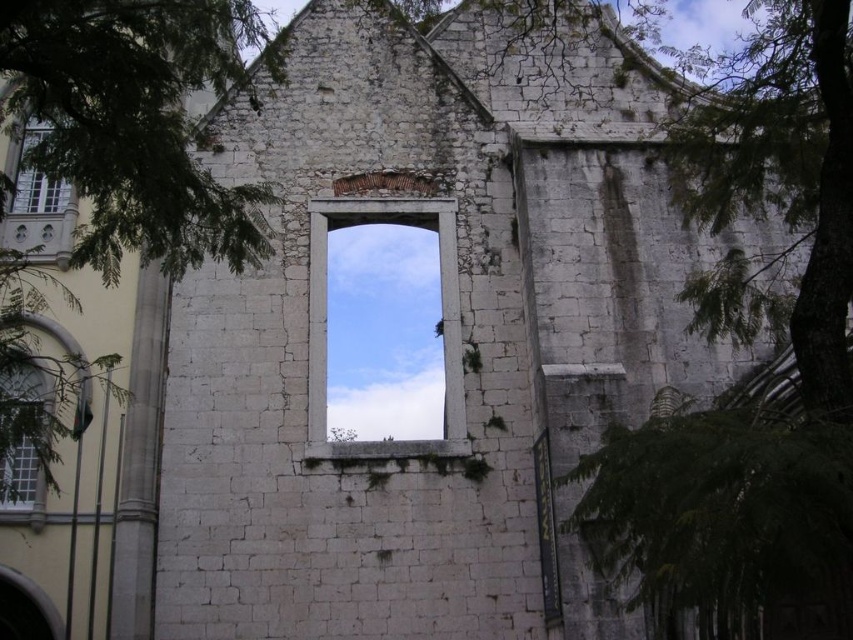
Between point (236, 220) and point (315, 248), which one is positioned in front?

Point (236, 220) is in front.

Is green leafy tree at upper left further to the viewer compared to white stone window at center?

No.

Measure the distance between green leafy tree at upper left and camera.

green leafy tree at upper left is 41.50 meters away from camera.

Where is `green leafy tree at upper left`? green leafy tree at upper left is located at coordinates (137, 122).

Can you confirm if green leafy tree at right is thinner than matte glass window at upper left?

Incorrect, green leafy tree at right's width is not less than matte glass window at upper left's.

Is point (795, 8) more distant than point (27, 125)?

No, it is in front of (27, 125).

The height and width of the screenshot is (640, 853). In order to click on green leafy tree at right in this screenshot , I will do `click(775, 184)`.

Can you confirm if green leafy tree at upper left is bigger than clear glass window at lower left?

Indeed, green leafy tree at upper left has a larger size compared to clear glass window at lower left.

What do you see at coordinates (137, 122) in the screenshot? I see `green leafy tree at upper left` at bounding box center [137, 122].

At what (x,y) coordinates should I click in order to perform the action: click on green leafy tree at upper left. Please return your answer as a coordinate pair (x, y). The width and height of the screenshot is (853, 640). Looking at the image, I should click on (137, 122).